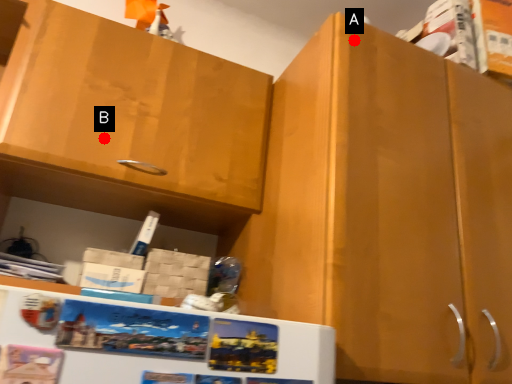
Question: Two points are circled on the image, labeled by A and B beside each circle. Which of the following is the closest to the observer?

Choices:
 (A) A is closer
 (B) B is closer

Answer: (A)